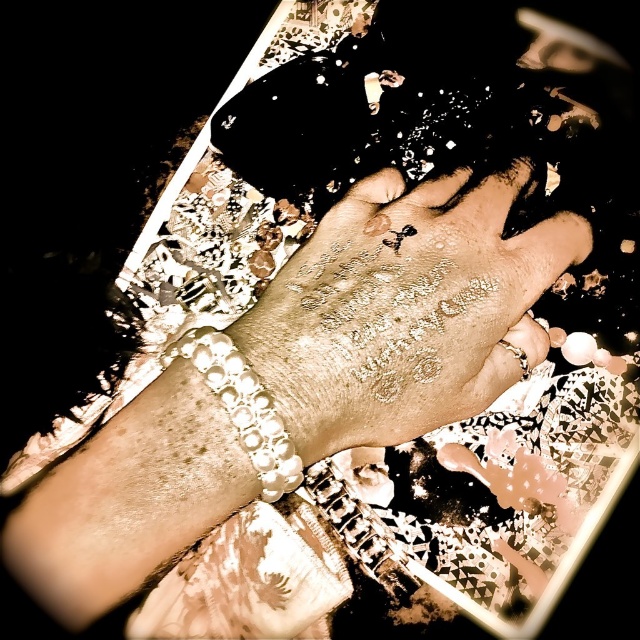
Does point (483, 230) lie in front of point (257, 444)?

That is False.

Is gold glittery hand at center to the right of pearl-like bracelet at lower left from the viewer's perspective?

Correct, you'll find gold glittery hand at center to the right of pearl-like bracelet at lower left.

Does point (442, 340) come farther from viewer compared to point (241, 432)?

Yes, it is behind point (241, 432).

Locate an element on the screen. Image resolution: width=640 pixels, height=640 pixels. gold glittery hand at center is located at coordinates pyautogui.click(x=404, y=308).